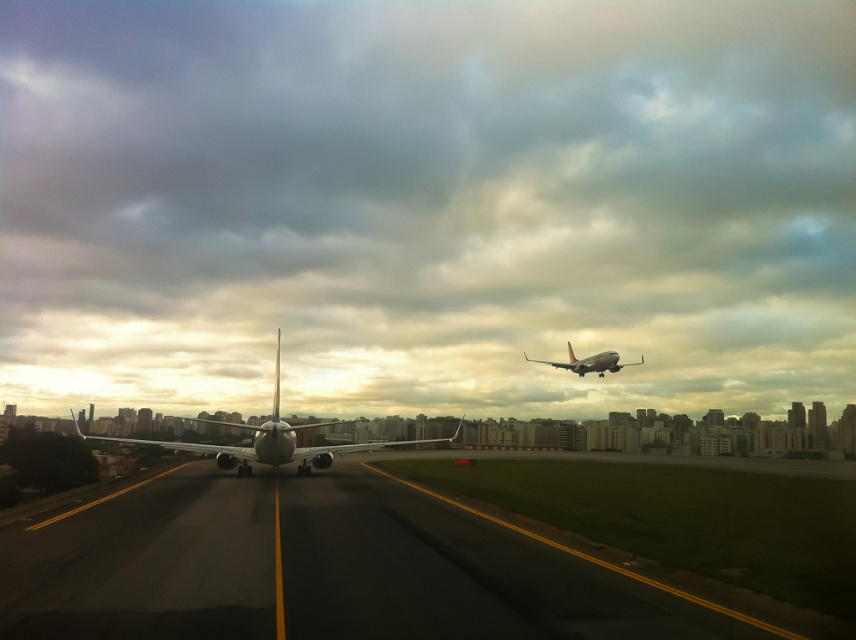
Locate an element on the screen. Image resolution: width=856 pixels, height=640 pixels. black asphalt tarmac at center is located at coordinates (348, 570).

Is point (322, 588) closer to camera compared to point (274, 401)?

Yes, point (322, 588) is closer to viewer.

Does point (253, 513) come in front of point (266, 438)?

Yes.

You are a GUI agent. You are given a task and a screenshot of the screen. Output one action in this format:
    pyautogui.click(x=<x>, y=<y>)
    Task: Click on the black asphalt tarmac at center
    The image size is (856, 640).
    Given the screenshot: What is the action you would take?
    pyautogui.click(x=348, y=570)

Describe the element at coordinates (348, 570) in the screenshot. This screenshot has width=856, height=640. I see `black asphalt tarmac at center` at that location.

Between black asphalt tarmac at center and metallic silver airplane at upper right, which one appears on the right side from the viewer's perspective?

From the viewer's perspective, metallic silver airplane at upper right appears more on the right side.

Locate an element on the screen. The width and height of the screenshot is (856, 640). black asphalt tarmac at center is located at coordinates (348, 570).

The image size is (856, 640). Identify the location of black asphalt tarmac at center. (348, 570).

Is silver metallic airplane at center thinner than metallic silver airplane at upper right?

Incorrect, silver metallic airplane at center's width is not less than metallic silver airplane at upper right's.

Between silver metallic airplane at center and metallic silver airplane at upper right, which one appears on the right side from the viewer's perspective?

metallic silver airplane at upper right

Measure the distance between point [272,428] and camera.

70.30 feet

Where is `silver metallic airplane at center`? This screenshot has height=640, width=856. silver metallic airplane at center is located at coordinates (271, 440).